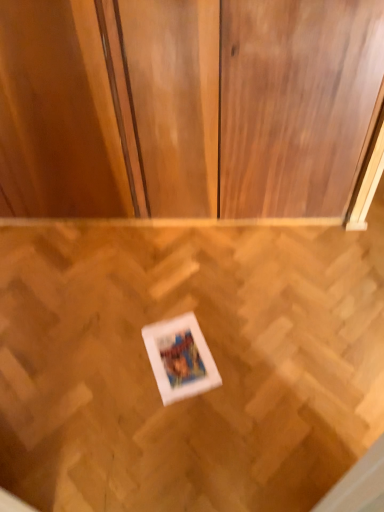
You are a GUI agent. You are given a task and a screenshot of the screen. Output one action in this format:
    pyautogui.click(x=<x>, y=<y>)
    Task: Click on the free space to the back side of white matte picture frame at center
    This screenshot has height=512, width=384.
    Given the screenshot: What is the action you would take?
    pyautogui.click(x=175, y=298)